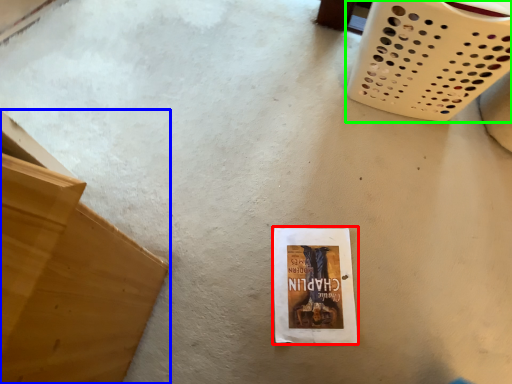
Question: Which object is positioned closest to paperback book (highlighted by a red box)? Select from furniture (highlighted by a blue box) and basket (highlighted by a green box).

Choices:
 (A) furniture
 (B) basket

Answer: (A)